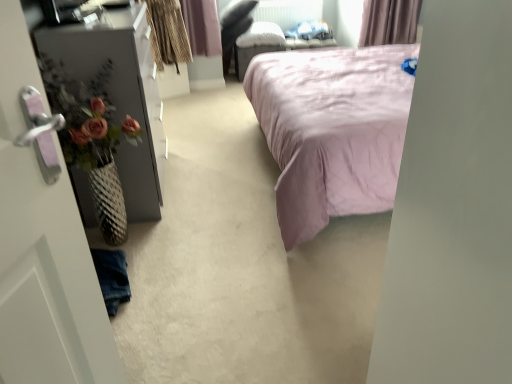
Question: Is white plastic radiator at upper center at the right side of matte black dresser at left?

Choices:
 (A) yes
 (B) no

Answer: (A)

Question: From the image's perspective, would you say white plastic radiator at upper center is shown under matte black dresser at left?

Choices:
 (A) yes
 (B) no

Answer: (B)

Question: Does white plastic radiator at upper center have a greater height compared to matte black dresser at left?

Choices:
 (A) no
 (B) yes

Answer: (A)

Question: Can you see white plastic radiator at upper center touching matte black dresser at left?

Choices:
 (A) yes
 (B) no

Answer: (B)

Question: Does white plastic radiator at upper center have a lesser height compared to matte black dresser at left?

Choices:
 (A) yes
 (B) no

Answer: (A)

Question: Is matte black dresser at left completely or partially inside white plastic radiator at upper center?

Choices:
 (A) yes
 (B) no

Answer: (B)

Question: Is matte black dresser at left looking in the opposite direction of white plastic radiator at upper center?

Choices:
 (A) no
 (B) yes

Answer: (A)

Question: From a real-world perspective, is matte black dresser at left under white plastic radiator at upper center?

Choices:
 (A) yes
 (B) no

Answer: (A)

Question: Is matte black dresser at left aimed at white plastic radiator at upper center?

Choices:
 (A) no
 (B) yes

Answer: (A)

Question: Is matte black dresser at left wider than white plastic radiator at upper center?

Choices:
 (A) no
 (B) yes

Answer: (B)

Question: From the image's perspective, is matte black dresser at left below white plastic radiator at upper center?

Choices:
 (A) no
 (B) yes

Answer: (B)

Question: Is matte black dresser at left at the left side of white plastic radiator at upper center?

Choices:
 (A) yes
 (B) no

Answer: (A)

Question: Is pink satin bed at center to the left of matte black dresser at left from the viewer's perspective?

Choices:
 (A) yes
 (B) no

Answer: (B)